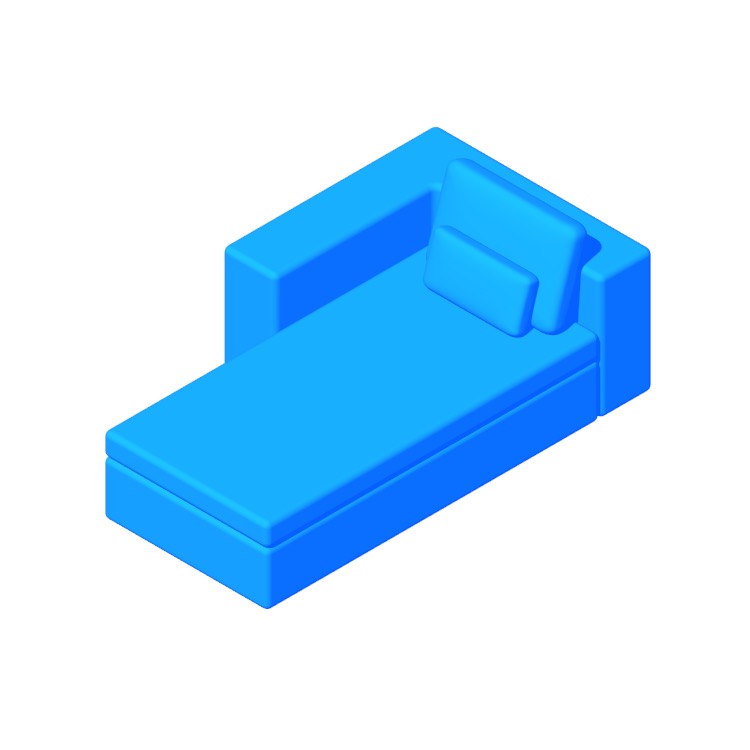
This screenshot has height=750, width=750. What are the coordinates of `space above couch` in the screenshot? It's located at (452, 110).